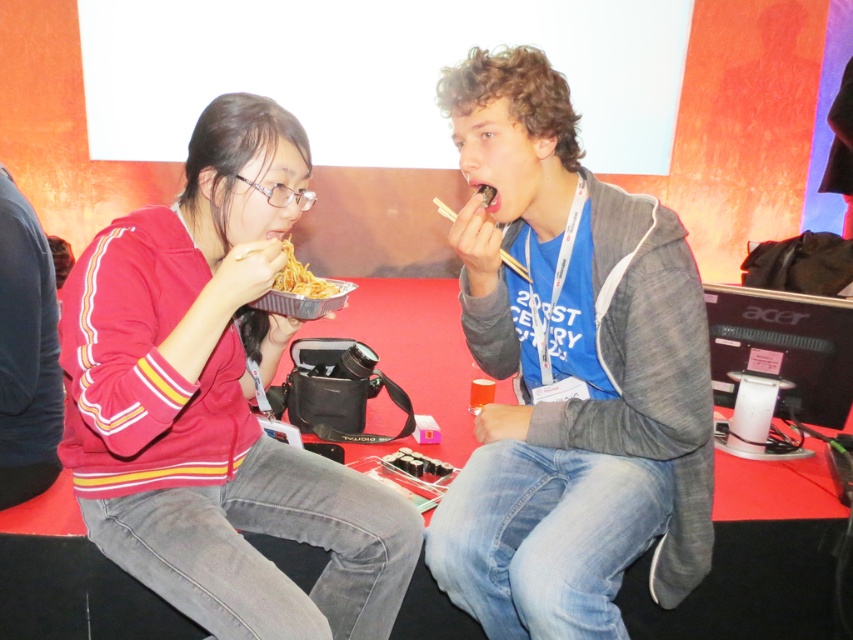
You are sitting at the table with two people. You need to place a small item on the table. There are two points marked on the table. The first point is at coordinates point (660, 216) and the second point is at coordinates point (294, 291). Which point is closer to you if you are facing the table from the front?

Point (660, 216) is in front of point (294, 291), so if you are facing the table from the front, the point closer to you would be point (660, 216).

You are trying to place a small item on the table between the gray fleece jacket at center and the shiny metallic noodles at center. Is there enough space for the item to fit between them?

The gray fleece jacket at center is to the right of the shiny metallic noodles at center, so there is space between them for the item to fit.

You are trying to decide whether to place a small keychain on the table without it being blocked by existing items. The matte red sweater at center and wooden chopsticks at upper center are on the table. Which item takes up more space on the table?

The matte red sweater at center has a larger size compared to wooden chopsticks at upper center, so it takes up more space on the table.